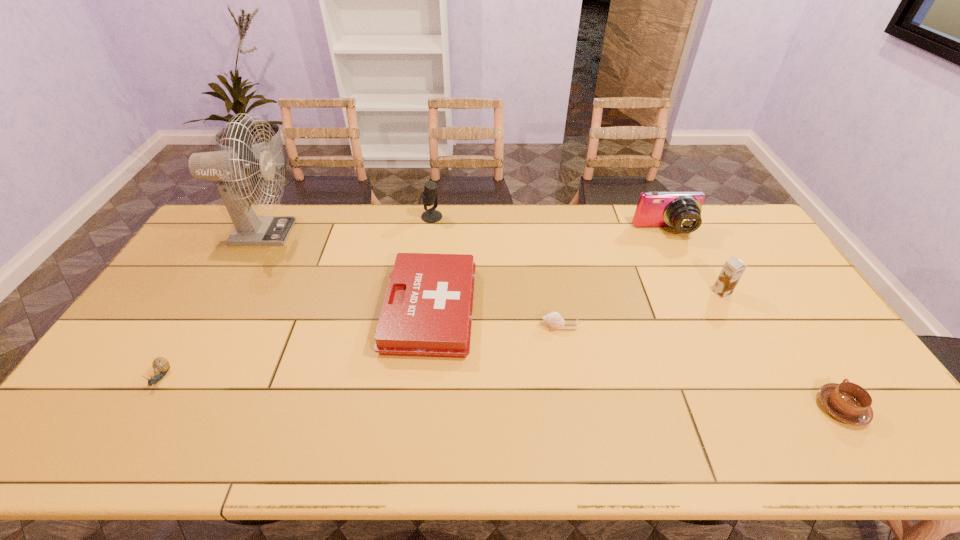
This screenshot has width=960, height=540. In order to click on free spot located on the front of the microphone in this screenshot , I will do `click(425, 265)`.

Image resolution: width=960 pixels, height=540 pixels. What are the coordinates of `free space located on the front-facing side of the camera` in the screenshot? It's located at (688, 279).

Identify the location of vacant space located 0.320m on the front of the chocolate milk. Image resolution: width=960 pixels, height=540 pixels. (776, 391).

You are a GUI agent. You are given a task and a screenshot of the screen. Output one action in this format:
    pyautogui.click(x=<x>, y=<y>)
    Task: Click on the free space located 0.080m on the back of the fourth shortest object
    
    Given the screenshot: What is the action you would take?
    pyautogui.click(x=436, y=251)

What are the coordinates of `free space located 0.110m on the side of the cappuccino with the handle` in the screenshot? It's located at (805, 352).

The image size is (960, 540). What are the coordinates of `blank area located 0.360m on the side of the cappuccino with the handle` in the screenshot? It's located at (763, 287).

Identify the location of vacant space located on the side of the cappuccino with the handle. (805, 352).

In order to click on vacant space located 0.360m on the shell of the farther escargot in this screenshot , I will do `click(415, 326)`.

Where is `free spot located on the shell of the farther escargot`? The height and width of the screenshot is (540, 960). free spot located on the shell of the farther escargot is located at coordinates (446, 326).

Identify the location of free spot located 0.340m on the shell of the farther escargot. The height and width of the screenshot is (540, 960). (421, 326).